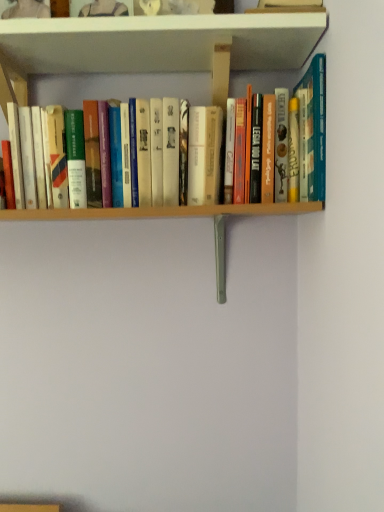
Measure the distance between wooden books at center and camera.

wooden books at center is 29.80 inches from camera.

Find the location of `wooden books at center`. wooden books at center is located at coordinates (220, 76).

Image resolution: width=384 pixels, height=512 pixels. Describe the element at coordinates (220, 76) in the screenshot. I see `wooden books at center` at that location.

Where is `wooden books at center`? The width and height of the screenshot is (384, 512). wooden books at center is located at coordinates [220, 76].